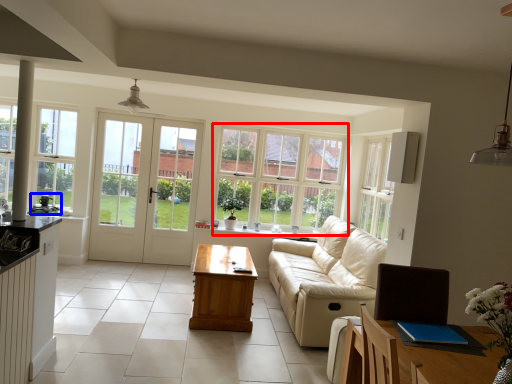
Question: Which of the following is the closest to the observer, window (highlighted by a red box) or appliance (highlighted by a blue box)?

Choices:
 (A) window
 (B) appliance

Answer: (B)